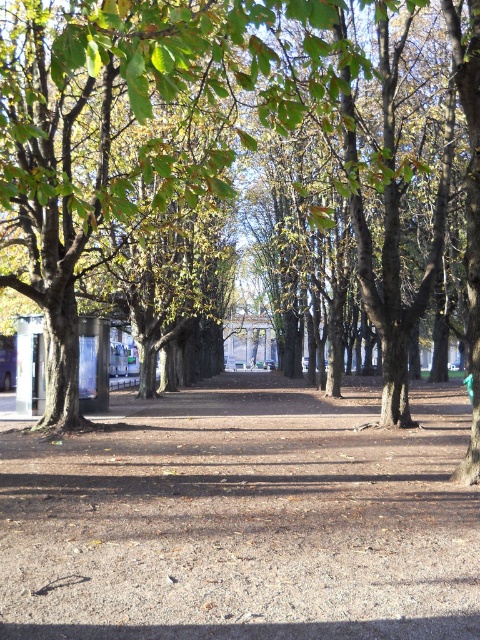
You are a hiker who wants to walk along the brown gravel path at center without getting hit by falling leaves from the green leafy tree at center. Which direction should you walk to stay under the tree canopy for shelter?

The brown gravel path at center is positioned under green leafy tree at center, so walking along the path in either direction will keep you under the tree canopy for shelter.

In the scene shown: You are standing on the brown gravel path at center and want to walk to the point labeled as point (242,518). Is the point on the path?

Yes, the point (242,518) is on the brown gravel path at center, so you can walk directly to it without leaving the path.

You are standing at the camera position in the park scene. You see two points marked in the image. Which point, point (242, 493) or point (186, 83), is nearer to you?

Point (242, 493) is closer to the camera than point (186, 83).